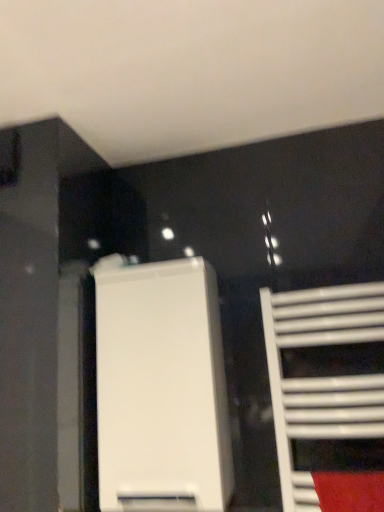
This screenshot has height=512, width=384. What do you see at coordinates (321, 377) in the screenshot?
I see `white metallic towel rack at right` at bounding box center [321, 377].

This screenshot has width=384, height=512. Find the location of `white metallic towel rack at right`. white metallic towel rack at right is located at coordinates (321, 377).

I want to click on white metallic towel rack at right, so click(x=321, y=377).